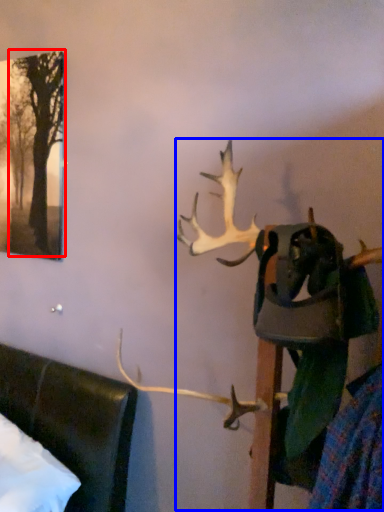
Question: Among these objects, which one is farthest to the camera, tree (highlighted by a red box) or deer (highlighted by a blue box)?

Choices:
 (A) tree
 (B) deer

Answer: (A)